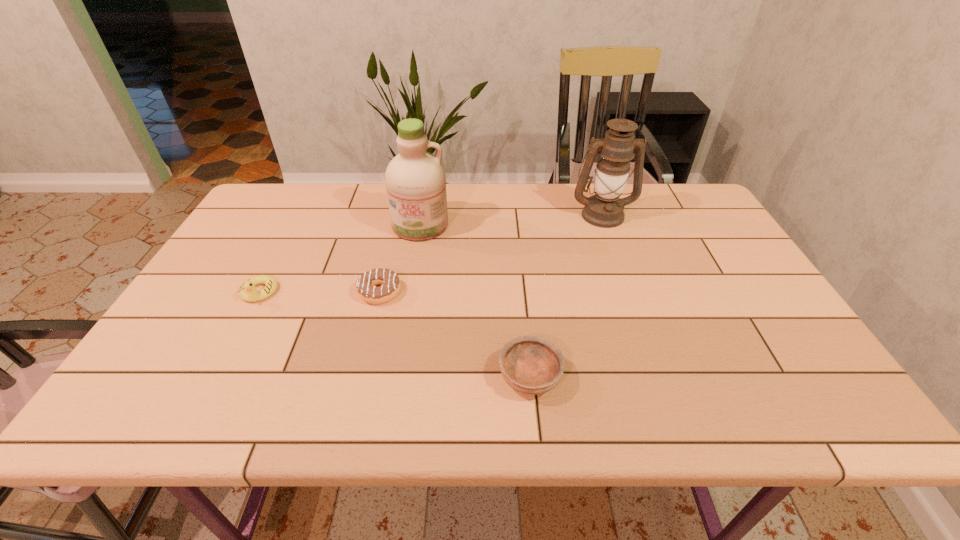
This screenshot has width=960, height=540. I want to click on free space located on the right of the doughnut, so click(549, 292).

In order to click on cleansing agent that is at the far edge in this screenshot , I will do `click(415, 180)`.

Where is `oil lamp at the far edge`? This screenshot has width=960, height=540. oil lamp at the far edge is located at coordinates (604, 209).

In order to click on object located at the near edge in this screenshot , I will do `click(533, 365)`.

Image resolution: width=960 pixels, height=540 pixels. Find the location of `object positioned at the left edge`. object positioned at the left edge is located at coordinates (247, 291).

Where is `free location at the far edge`? The height and width of the screenshot is (540, 960). free location at the far edge is located at coordinates (483, 183).

Where is `free space at the near edge`? The height and width of the screenshot is (540, 960). free space at the near edge is located at coordinates (411, 393).

This screenshot has width=960, height=540. I want to click on free location at the left edge of the desktop, so click(x=224, y=343).

The width and height of the screenshot is (960, 540). In the image, there is a desktop. Find the location of `vacant space at the right edge`. vacant space at the right edge is located at coordinates [697, 227].

At what (x,y) coordinates should I click in order to perform the action: click on free spot at the far left corner of the desktop. Please return your answer as a coordinate pair (x, y). Image resolution: width=960 pixels, height=540 pixels. Looking at the image, I should click on (298, 210).